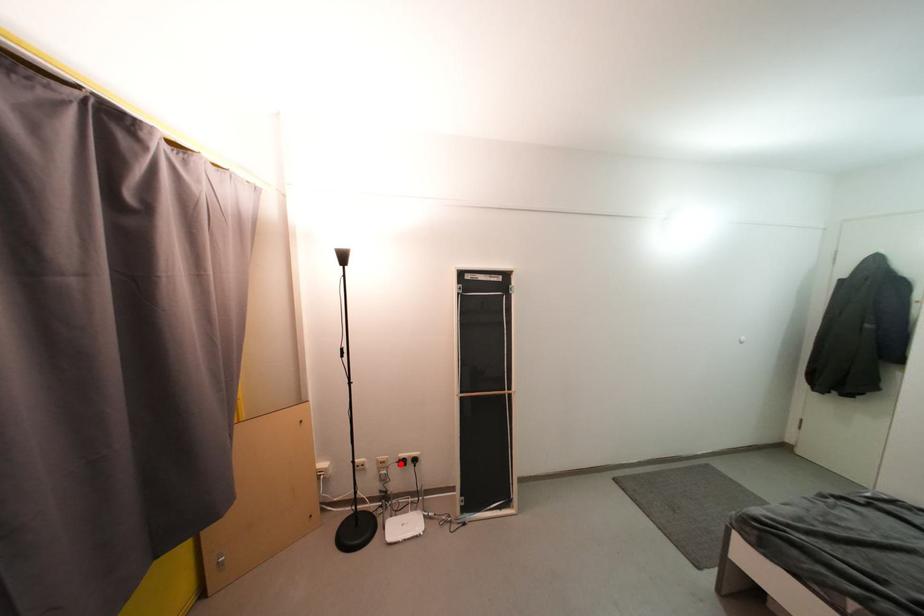
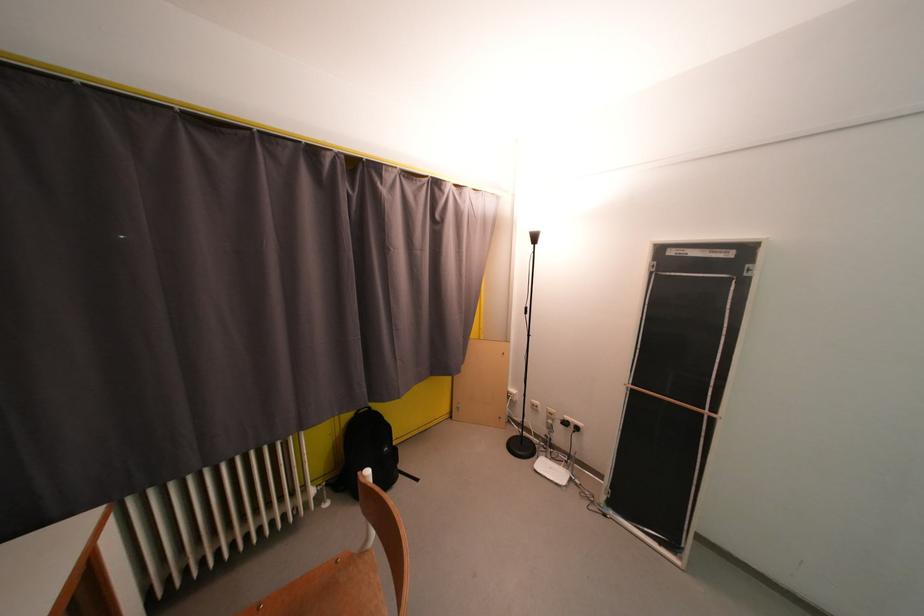
Question: I am providing you with two images of the same scene from different viewpoints. Image1 has a red point marked. In image2, the corresponding 3D location appears at what relative position? Reply with the corresponding letter.

Choices:
 (A) Closer
 (B) Farther

Answer: (A)